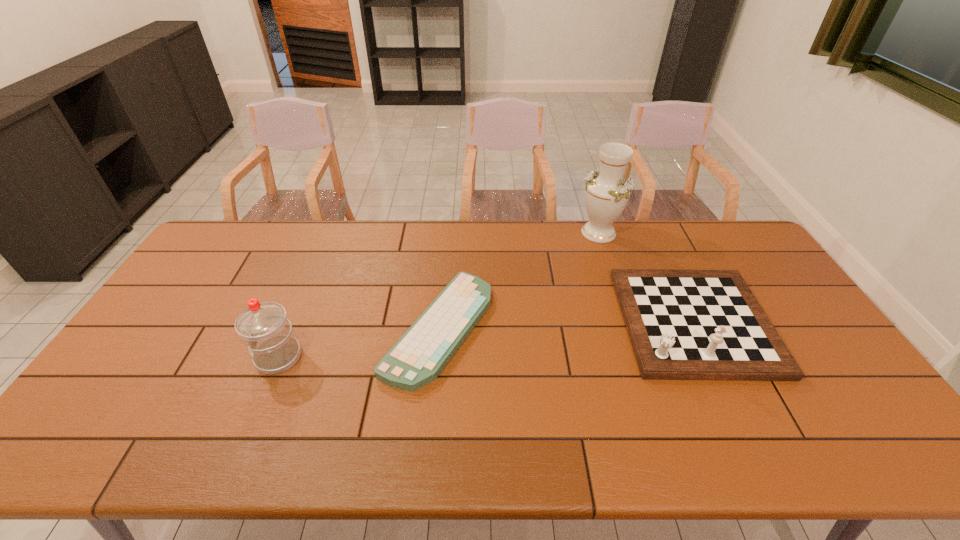
Identify the location of vacant space that satisfies the following two spatial constraints: 1. on the back side of the computer keyboard; 2. on the left side of the gameboard. This screenshot has width=960, height=540. coord(439,322).